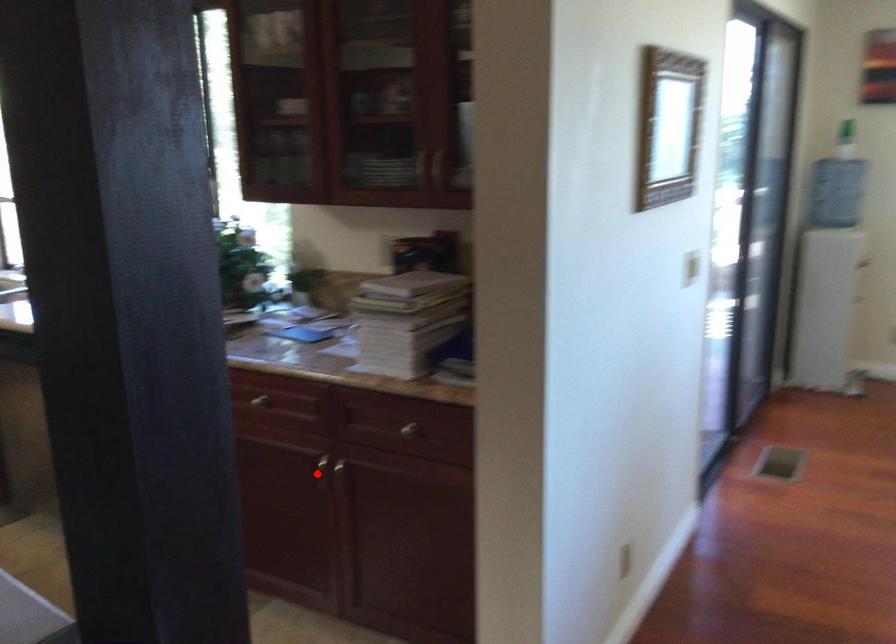
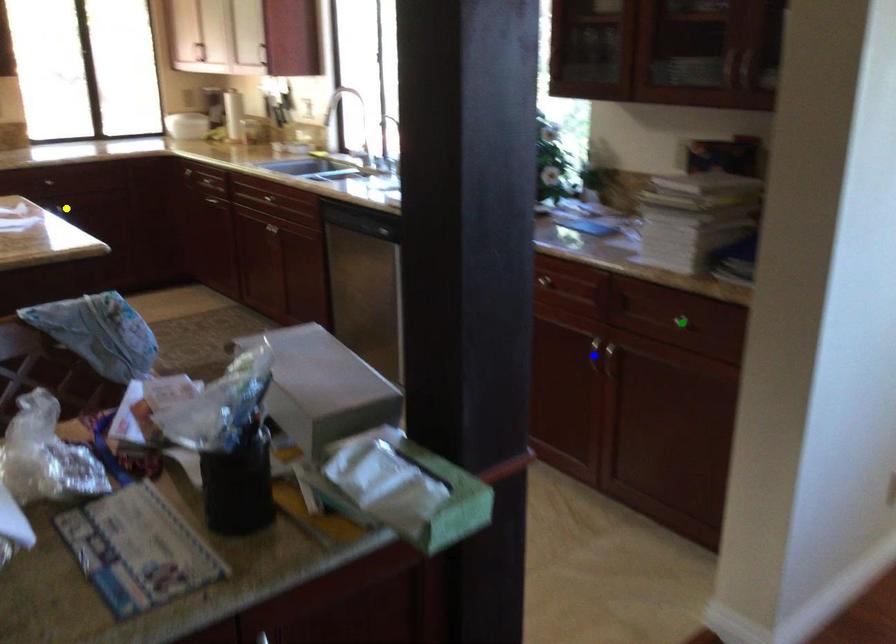
Question: I am providing you with two images of the same scene from different viewpoints. A red point is marked on the first image. You are given multiple points on the second image. In image 2, which mark is for the same physical point as the one in image 1?

Choices:
 (A) blue point
 (B) yellow point
 (C) green point

Answer: (A)